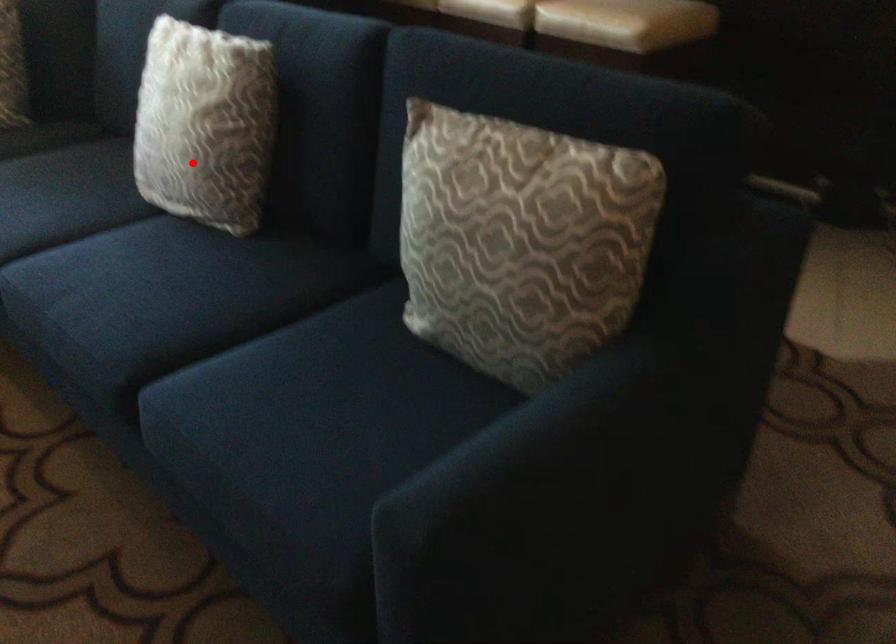
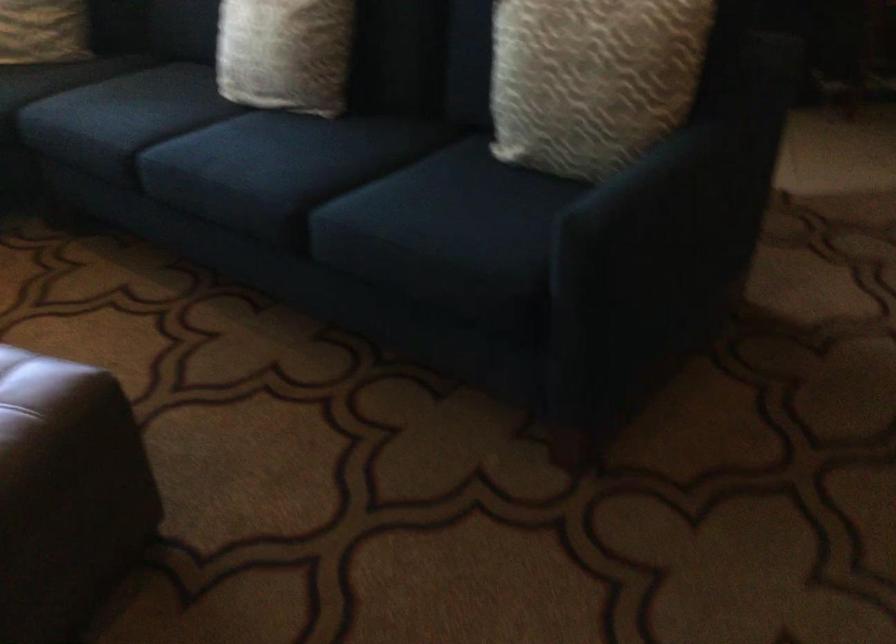
Question: I am providing you with two images of the same scene from different viewpoints. A red point is shown in image1. For the corresponding object point in image2, is it positioned nearer or farther from the camera?

Choices:
 (A) Nearer
 (B) Farther

Answer: (B)